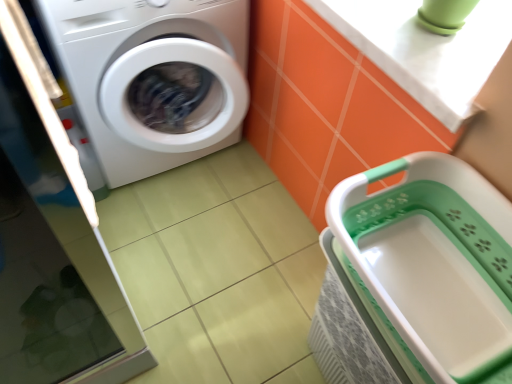
Question: In the image, is white glossy counter top at upper right positioned in front of or behind white glossy washing machine at left?

Choices:
 (A) front
 (B) behind

Answer: (A)

Question: Would you say white glossy counter top at upper right is inside or outside white glossy washing machine at left?

Choices:
 (A) inside
 (B) outside

Answer: (B)

Question: Estimate the real-world distances between objects in this image. Which object is farther from the white glossy washing machine at left?

Choices:
 (A) white plastic basket at lower right
 (B) white glossy counter top at upper right

Answer: (A)

Question: Which object is positioned farthest from the white glossy counter top at upper right?

Choices:
 (A) white plastic basket at lower right
 (B) white glossy washing machine at left

Answer: (B)